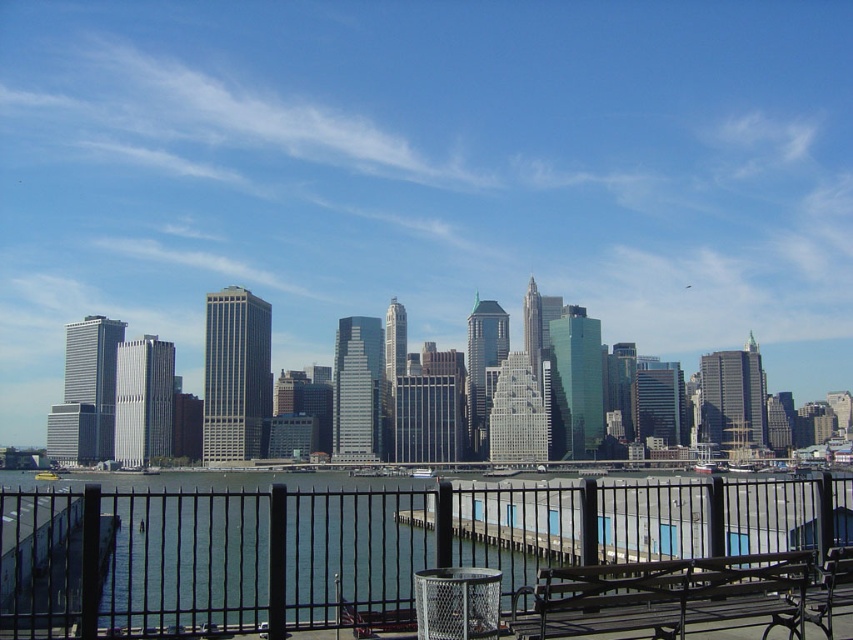
Is point (193, 588) less distant than point (791, 628)?

No, it is behind (791, 628).

Which is more to the left, clear water at lower center or brown wooden bench at lower right?

clear water at lower center is more to the left.

I want to click on clear water at lower center, so click(427, 560).